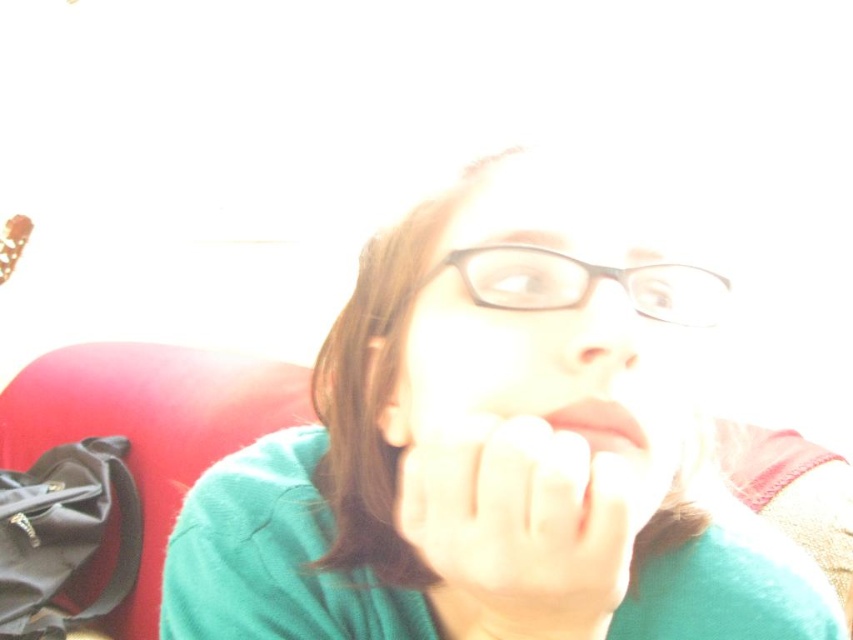
Question: Can you confirm if green matte sweater at center is positioned below transparent plastic glasses at center?

Choices:
 (A) no
 (B) yes

Answer: (B)

Question: Which point is closer to the camera?

Choices:
 (A) (614, 321)
 (B) (415, 561)
 (C) (445, 264)

Answer: (A)

Question: Does green matte sweater at center appear on the left side of matte skin nose at center?

Choices:
 (A) yes
 (B) no

Answer: (A)

Question: Which object is the farthest from the smooth skin hand at center?

Choices:
 (A) transparent plastic glasses at center
 (B) matte skin nose at center

Answer: (A)

Question: Is transparent plastic glasses at center positioned in front of pink matte lips at center?

Choices:
 (A) yes
 (B) no

Answer: (B)

Question: Which point is closer to the camera taking this photo?

Choices:
 (A) (573, 413)
 (B) (606, 289)
 (C) (440, 605)
 (D) (524, 547)

Answer: (D)